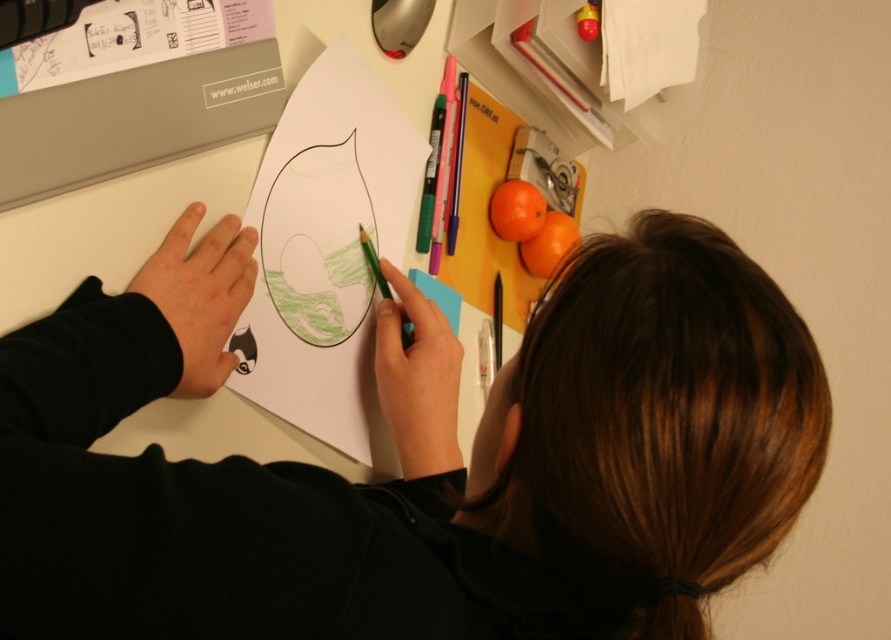
Between black matte hoodie at center and green paper at center, which one is positioned lower?

black matte hoodie at center is lower down.

Does black matte hoodie at center have a lesser width compared to green paper at center?

In fact, black matte hoodie at center might be wider than green paper at center.

Identify the location of black matte hoodie at center. The height and width of the screenshot is (640, 891). (418, 460).

You are a GUI agent. You are given a task and a screenshot of the screen. Output one action in this format:
    pyautogui.click(x=<x>, y=<y>)
    Task: Click on the black matte hoodie at center
    This screenshot has height=640, width=891.
    Given the screenshot: What is the action you would take?
    pyautogui.click(x=418, y=460)

Where is `green paper at center`? The height and width of the screenshot is (640, 891). green paper at center is located at coordinates (325, 250).

Who is higher up, green paper at center or orange matte at upper right?

orange matte at upper right is above.

Is point (334, 260) behind point (560, 257)?

No.

At what (x,y) coordinates should I click in order to perform the action: click on green paper at center. Please return your answer as a coordinate pair (x, y). The width and height of the screenshot is (891, 640). Looking at the image, I should click on (325, 250).

Between point (391, 406) and point (537, 227), which one is positioned behind?

The point (537, 227) is more distant.

From the picture: Between black matte hoodie at center and orange matte at upper center, which one is positioned lower?

black matte hoodie at center

Is point (84, 580) less distant than point (516, 228)?

Yes, it is in front of point (516, 228).

The height and width of the screenshot is (640, 891). What are the coordinates of `black matte hoodie at center` in the screenshot? It's located at (418, 460).